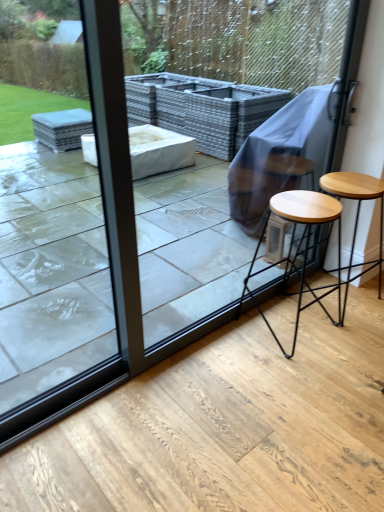
The image size is (384, 512). I want to click on vacant area on top of light brown wood stool at right, the 2th stool positioned from the left (from a real-world perspective), so click(x=357, y=184).